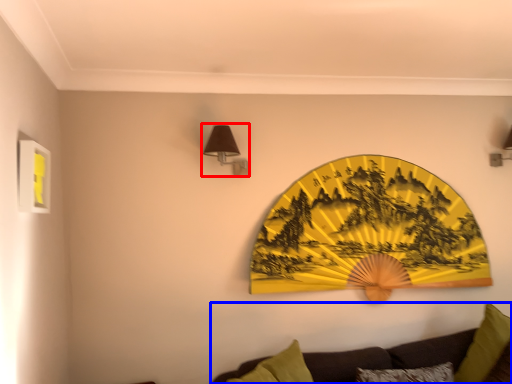
Question: Among these objects, which one is farthest to the camera, lamp (highlighted by a red box) or studio couch (highlighted by a blue box)?

Choices:
 (A) lamp
 (B) studio couch

Answer: (A)